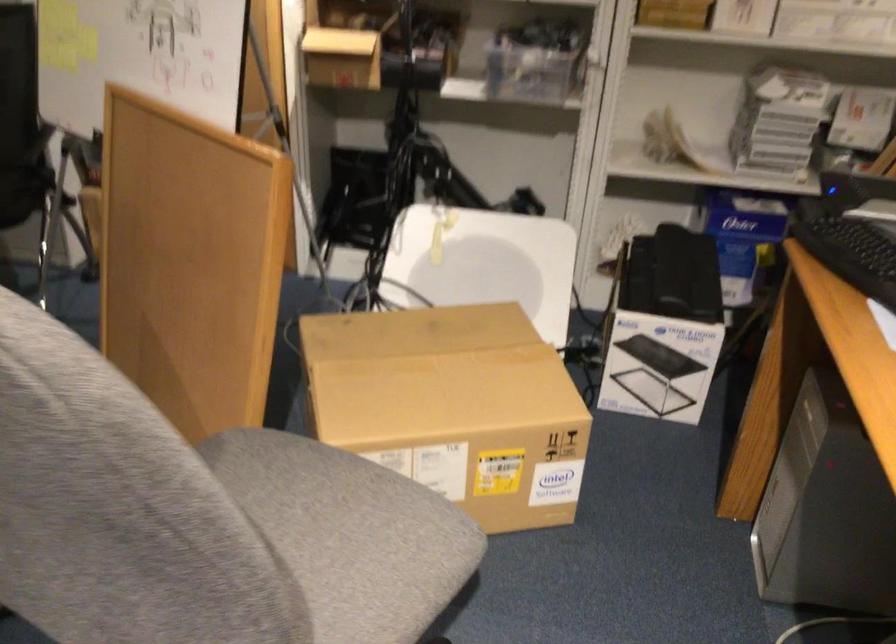
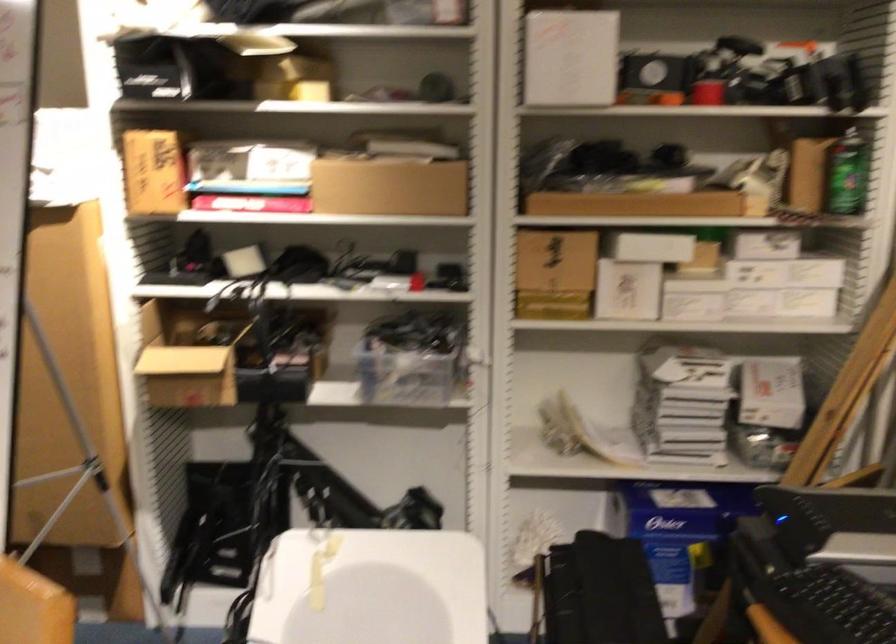
Question: Which direction would the cameraman need to move to produce the second image? Reply with the corresponding letter.

Choices:
 (A) Left
 (B) Right
 (C) Forward
 (D) Backward

Answer: (C)